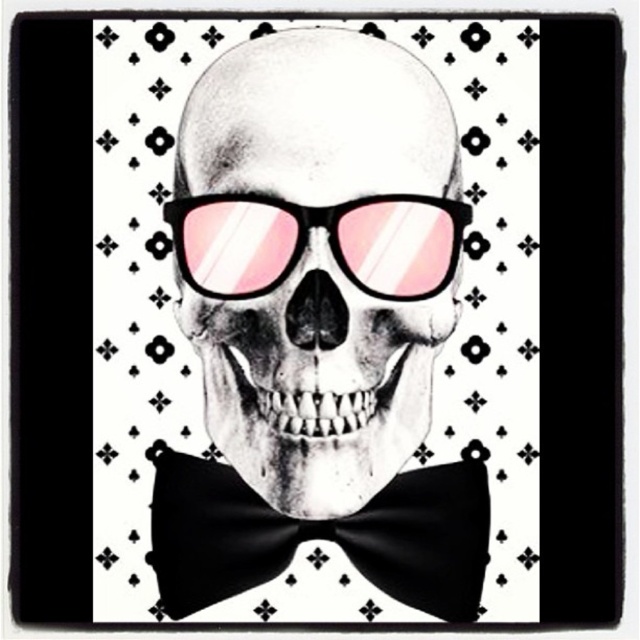
Is black matte skull at center above black satin bow tie at center?

Correct, black matte skull at center is located above black satin bow tie at center.

Is black matte skull at center below black satin bow tie at center?

Incorrect, black matte skull at center is not positioned below black satin bow tie at center.

Between point (340, 314) and point (353, 545), which one is positioned in front?

Point (340, 314) is in front.

Where is `black matte skull at center`? black matte skull at center is located at coordinates (316, 381).

Is black matte skull at center below pink reflective plastic goggles at center?

Yes.

Who is more distant from viewer, (291, 348) or (268, 266)?

Positioned behind is point (268, 266).

Is point (452, 296) farther from camera compared to point (312, 216)?

Yes, point (452, 296) is farther from viewer.

This screenshot has width=640, height=640. Identify the location of black matte skull at center. (316, 381).

Measure the distance between point (476,544) and camera.

Point (476,544) and camera are 3.49 feet apart from each other.

Does black satin bow tie at center appear over pink reflective plastic goggles at center?

Actually, black satin bow tie at center is below pink reflective plastic goggles at center.

Does point (355, 522) come closer to viewer compared to point (259, 266)?

That is False.

The width and height of the screenshot is (640, 640). Identify the location of black satin bow tie at center. (320, 536).